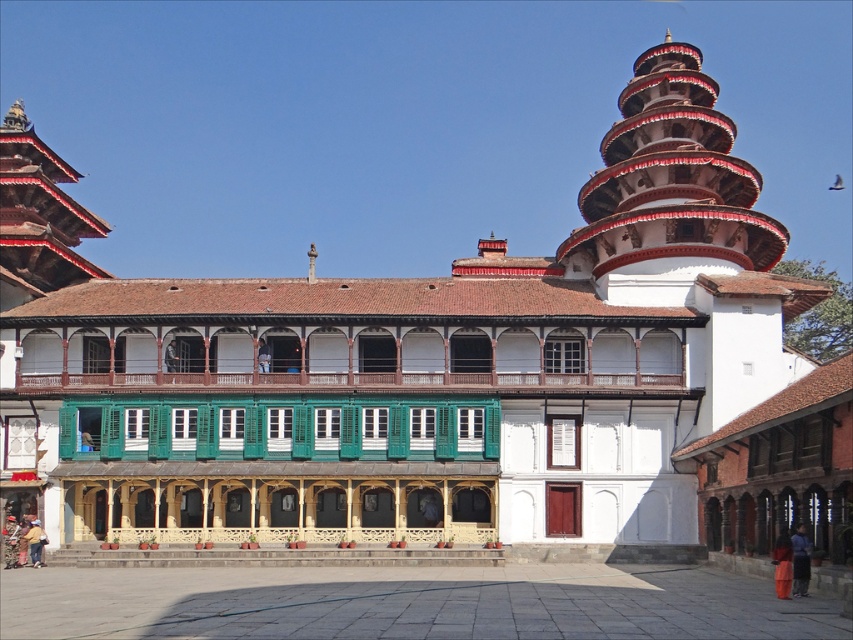
You are standing in front of the traditional building and notice the white painted wood tower at upper right and the dark blue fabric at lower right. Which object is positioned to the right side of the other?

The white painted wood tower at upper right is to the right of dark blue fabric at lower right.

You are standing at the entrance of the building and want to locate the white painted wood tower at upper right. According to the coordinates provided, where should you look relative to your current position?

The white painted wood tower at upper right is located at coordinates point 0.280 on the x axis and 0.788 on the y axis, so you should look to the upper right direction from your current position at the entrance.

You are standing in front of the building and want to see the dark blue fabric at lower right. Is it possible to see it without moving your position, considering the white painted wood tower at upper right?

The dark blue fabric at lower right is behind the white painted wood tower at upper right, so it is likely obstructed and not fully visible from your current position.